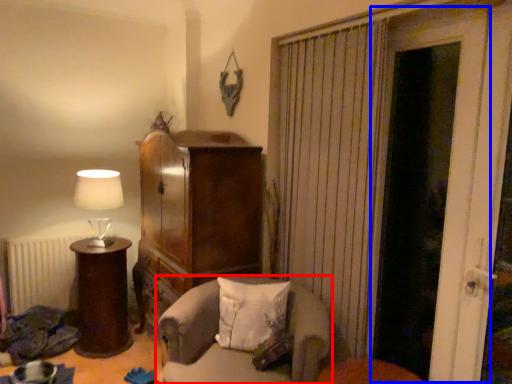
Question: Which object is closer to the camera taking this photo, chair (highlighted by a red box) or door (highlighted by a blue box)?

Choices:
 (A) chair
 (B) door

Answer: (B)